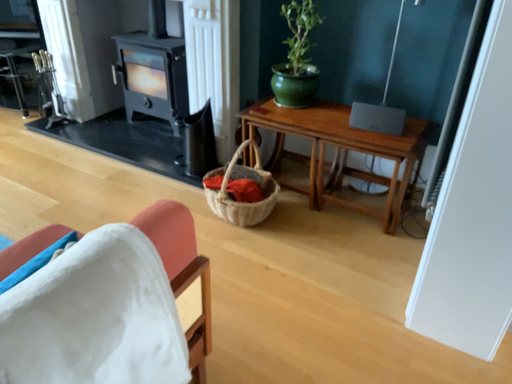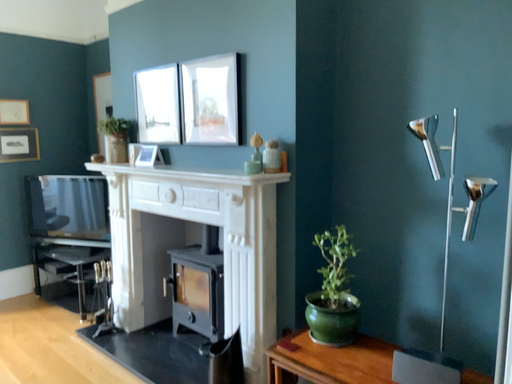
Question: How did the camera likely rotate when shooting the video?

Choices:
 (A) rotated right
 (B) rotated left

Answer: (B)